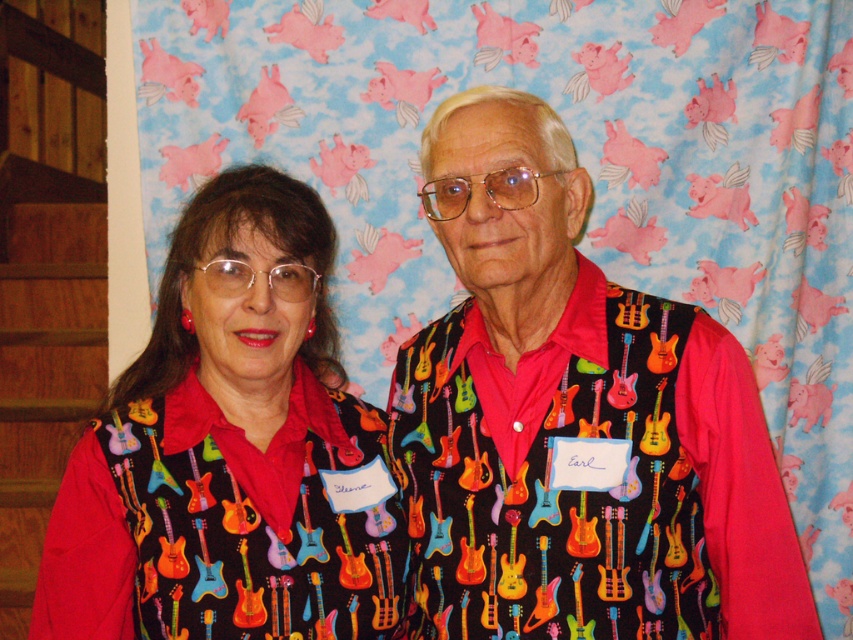
What is the relationship between the heights of the multicolored fabric guitar vest at center and the matte black shirt with guitar pattern at center?

The multicolored fabric guitar vest at center is much taller than the matte black shirt with guitar pattern at center.

You are a fashion designer trying to create a matching outfit for a third person. The third person needs to wear both the multicolored fabric guitar vest at center and the matte black shirt with guitar pattern at center. Is there enough space between them to wear both items comfortably?

The multicolored fabric guitar vest at center and matte black shirt with guitar pattern at center are 20.87 centimeters apart, which is sufficient space for a person to comfortably wear both items.